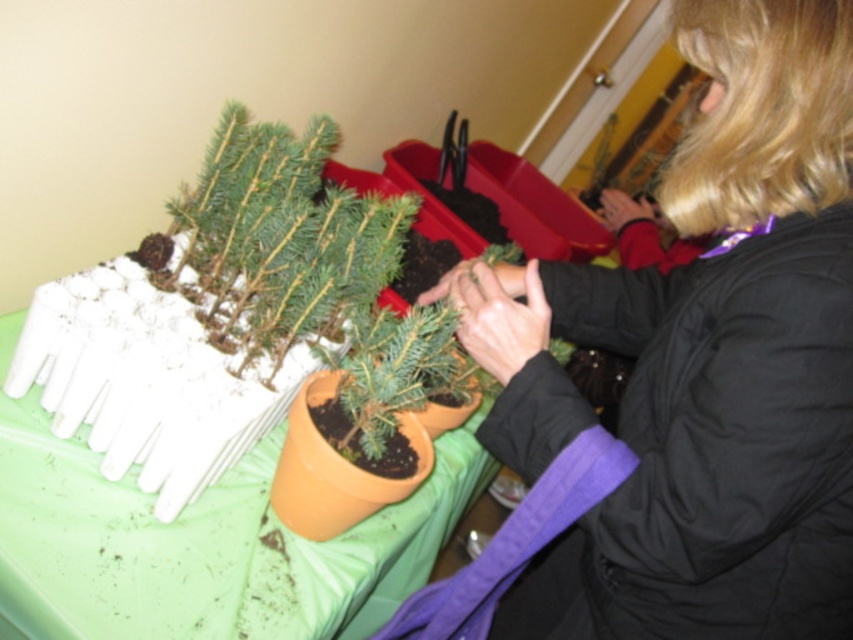
Where is the black jacket at center located in the image?

The black jacket at center is located at point coordinates of 0.566 on the x axis and 0.825 on the y axis.

You are a gardener who needs to place a 1.2 meter tall plant stand on the table. The stand requires a space taller than the black jacket at center. Can the green fabric tablecloth at lower left provide enough vertical space for the plant stand?

The black jacket at center is taller than the green fabric tablecloth at lower left. Since the plant stand needs to be taller than the black jacket at center, the green fabric tablecloth at lower left does not have enough vertical space to accommodate it.